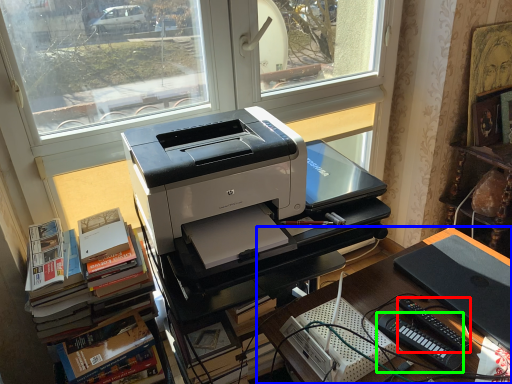
Question: Which object is positioned farthest from equipment (highlighted by a red box)? Select from desk (highlighted by a blue box) and equipment (highlighted by a green box).

Choices:
 (A) desk
 (B) equipment

Answer: (A)